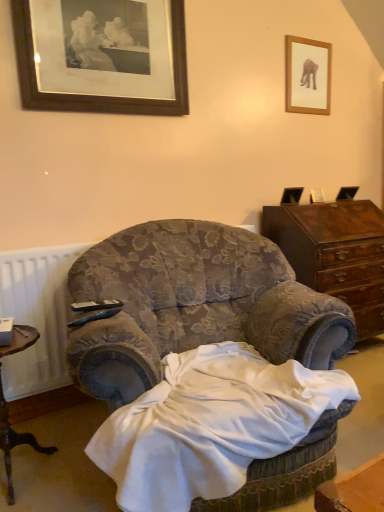
What is the approximate width of dark brown wood cabinet at right?

The width of dark brown wood cabinet at right is 49.28 centimeters.

What is the approximate height of wooden picture frame at upper right, the second picture frame from the left?

wooden picture frame at upper right, the second picture frame from the left, is 18.82 inches tall.

Locate an element on the screen. This screenshot has width=384, height=512. wooden picture frame at upper right, placed as the 1th picture frame when sorted from back to front is located at coordinates (307, 76).

The width and height of the screenshot is (384, 512). What are the coordinates of `black plastic remote control at center, the 1th remote control in the back-to-front sequence` in the screenshot? It's located at (96, 305).

In terms of width, does brown wooden desk at lower left look wider or thinner when compared to dark brown wood cabinet at right?

Considering their sizes, brown wooden desk at lower left looks slimmer than dark brown wood cabinet at right.

Is brown wooden desk at lower left aimed at dark brown wood cabinet at right?

No.

Would you say dark brown wood cabinet at right is part of brown wooden desk at lower left's contents?

No, dark brown wood cabinet at right is not a part of brown wooden desk at lower left.

You are a GUI agent. You are given a task and a screenshot of the screen. Output one action in this format:
    pyautogui.click(x=<x>, y=<y>)
    Task: Click on the cabinetry above the brown wooden desk at lower left (from a real-world perspective)
    The width and height of the screenshot is (384, 512).
    Given the screenshot: What is the action you would take?
    [x=335, y=253]

Can you confirm if wooden picture frame at upper left, arranged as the 1th picture frame when viewed from the front, is shorter than black plastic remote control at center, the 2th remote control positioned from the front?

Incorrect, the height of wooden picture frame at upper left, arranged as the 1th picture frame when viewed from the front, does not fall short of that of black plastic remote control at center, the 2th remote control positioned from the front.

Identify the location of picture frame that is the 1st object located above the black plastic remote control at center, the 2th remote control positioned from the front (from the image's perspective). This screenshot has width=384, height=512. (102, 56).

Is wooden picture frame at upper left, which is the 2th picture frame from right to left, looking in the opposite direction of black plastic remote control at center, the 1th remote control in the back-to-front sequence?

No.

Considering the sizes of objects black plastic remote control at lower left, acting as the 2th remote control starting from the back, and brown wooden desk at lower left in the image provided, who is bigger, black plastic remote control at lower left, acting as the 2th remote control starting from the back, or brown wooden desk at lower left?

Bigger between the two is brown wooden desk at lower left.

Is black plastic remote control at lower left, the 1th remote control positioned from the front, positioned with its back to brown wooden desk at lower left?

black plastic remote control at lower left, the 1th remote control positioned from the front, does not have its back to brown wooden desk at lower left.

Is black plastic remote control at lower left, acting as the 2th remote control starting from the back, shorter than brown wooden desk at lower left?

Correct, black plastic remote control at lower left, acting as the 2th remote control starting from the back, is not as tall as brown wooden desk at lower left.

Considering the positions of point (86, 314) and point (8, 493), is point (86, 314) closer or farther from the camera than point (8, 493)?

Point (86, 314) is closer to the camera than point (8, 493).

Based on the photo, from a real-world perspective, between brown wooden desk at lower left and black plastic remote control at center, the 2th remote control positioned from the front, who is vertically higher?

black plastic remote control at center, the 2th remote control positioned from the front, from a real-world perspective.

Is brown wooden desk at lower left bigger than black plastic remote control at center, the 1th remote control in the back-to-front sequence?

Correct, brown wooden desk at lower left is larger in size than black plastic remote control at center, the 1th remote control in the back-to-front sequence.

Measure the distance between brown wooden desk at lower left and black plastic remote control at center, the 1th remote control in the back-to-front sequence.

brown wooden desk at lower left and black plastic remote control at center, the 1th remote control in the back-to-front sequence, are 22.49 inches apart.

In the image, there is a black plastic remote control at center, the 2th remote control positioned from the front. Where is `desk below it (from a real-world perspective)`? desk below it (from a real-world perspective) is located at coordinates (14, 442).

Considering the sizes of objects dark brown wood cabinet at right and black plastic remote control at lower left, acting as the 2th remote control starting from the back, in the image provided, who is smaller, dark brown wood cabinet at right or black plastic remote control at lower left, acting as the 2th remote control starting from the back,?

With smaller size is black plastic remote control at lower left, acting as the 2th remote control starting from the back.

In the scene shown: From a real-world perspective, does dark brown wood cabinet at right sit lower than black plastic remote control at lower left, the 1th remote control positioned from the front?

Yes, from a real-world perspective, dark brown wood cabinet at right is below black plastic remote control at lower left, the 1th remote control positioned from the front.

Consider the image. Which object is further away from the camera taking this photo, dark brown wood cabinet at right or black plastic remote control at lower left, the 1th remote control positioned from the front?

dark brown wood cabinet at right is behind.

Considering the points (312, 73) and (77, 319), which point is behind, point (312, 73) or point (77, 319)?

The point (312, 73) is behind.

Who is bigger, wooden picture frame at upper right, placed as the 1th picture frame when sorted from back to front, or black plastic remote control at lower left, acting as the 2th remote control starting from the back?

wooden picture frame at upper right, placed as the 1th picture frame when sorted from back to front, is bigger.

Considering the relative sizes of wooden picture frame at upper right, placed as the 1th picture frame when sorted from back to front, and black plastic remote control at lower left, acting as the 2th remote control starting from the back, in the image provided, is wooden picture frame at upper right, placed as the 1th picture frame when sorted from back to front, wider than black plastic remote control at lower left, acting as the 2th remote control starting from the back,?

Incorrect, the width of wooden picture frame at upper right, placed as the 1th picture frame when sorted from back to front, does not surpass that of black plastic remote control at lower left, acting as the 2th remote control starting from the back.

From the picture: From a real-world perspective, which object stands above the other?

In real-world perspective, wooden picture frame at upper left, the first picture frame from the left, is above.

Which of these two, wooden picture frame at upper right, the second picture frame from the left, or wooden picture frame at upper left, arranged as the 1th picture frame when viewed from the front, stands taller?

wooden picture frame at upper left, arranged as the 1th picture frame when viewed from the front, is taller.

Which object is further away from the camera taking this photo, wooden picture frame at upper right, placed as the 1th picture frame when sorted from back to front, or wooden picture frame at upper left, which is the 2th picture frame from right to left?

wooden picture frame at upper right, placed as the 1th picture frame when sorted from back to front, is further from the camera.

Considering the relative sizes of wooden picture frame at upper right, which is counted as the 1th picture frame, starting from the right, and wooden picture frame at upper left, the first picture frame from the left, in the image provided, is wooden picture frame at upper right, which is counted as the 1th picture frame, starting from the right, bigger than wooden picture frame at upper left, the first picture frame from the left,?

No, wooden picture frame at upper right, which is counted as the 1th picture frame, starting from the right, is not bigger than wooden picture frame at upper left, the first picture frame from the left.

Identify the location of cabinetry above the brown wooden desk at lower left (from a real-world perspective). (335, 253).

The image size is (384, 512). What are the coordinates of `the 1st picture frame behind the black plastic remote control at center, the 1th remote control in the back-to-front sequence, counting from the anchor's position` in the screenshot? It's located at (102, 56).

Considering their positions, is wooden picture frame at upper left, which is the 2th picture frame from right to left, positioned further to dark brown wood cabinet at right than wooden picture frame at upper right, which is counted as the 1th picture frame, starting from the right?

Among the two, wooden picture frame at upper left, which is the 2th picture frame from right to left, is located further to dark brown wood cabinet at right.

Looking at this image, when comparing their distances from wooden picture frame at upper left, the 2th picture frame in the back-to-front sequence, does brown wooden desk at lower left or dark brown wood cabinet at right seem further?

Among the two, brown wooden desk at lower left is located further to wooden picture frame at upper left, the 2th picture frame in the back-to-front sequence.

Looking at this image, from the image, which object appears to be nearer to black plastic remote control at lower left, the 1th remote control positioned from the front, wooden picture frame at upper left, the 2th picture frame in the back-to-front sequence, or black plastic remote control at center, the 1th remote control in the back-to-front sequence?

Based on the image, black plastic remote control at center, the 1th remote control in the back-to-front sequence, appears to be nearer to black plastic remote control at lower left, the 1th remote control positioned from the front.

Considering their positions, is black plastic remote control at lower left, the 1th remote control positioned from the front, positioned closer to brown wooden desk at lower left than velvet floral armchair at center?

black plastic remote control at lower left, the 1th remote control positioned from the front, is closer to brown wooden desk at lower left.

When comparing their distances from velvet floral armchair at center, does wooden picture frame at upper right, placed as the second picture frame when sorted from front to back, or brown wooden desk at lower left seem further?

wooden picture frame at upper right, placed as the second picture frame when sorted from front to back, is further to velvet floral armchair at center.

Which object lies further to the anchor point black plastic remote control at lower left, acting as the 2th remote control starting from the back, brown wooden desk at lower left or black plastic remote control at center, the 2th remote control positioned from the front?

Based on the image, brown wooden desk at lower left appears to be further to black plastic remote control at lower left, acting as the 2th remote control starting from the back.

From the image, which object appears to be nearer to wooden picture frame at upper left, the 2th picture frame in the back-to-front sequence, black plastic remote control at lower left, acting as the 2th remote control starting from the back, or black plastic remote control at center, the 1th remote control in the back-to-front sequence?

Based on the image, black plastic remote control at center, the 1th remote control in the back-to-front sequence, appears to be nearer to wooden picture frame at upper left, the 2th picture frame in the back-to-front sequence.

Considering their positions, is black plastic remote control at lower left, the 1th remote control positioned from the front, positioned further to wooden picture frame at upper left, arranged as the 1th picture frame when viewed from the front, than brown wooden desk at lower left?

Based on the image, brown wooden desk at lower left appears to be further to wooden picture frame at upper left, arranged as the 1th picture frame when viewed from the front.

At what (x,y) coordinates should I click in order to perform the action: click on remote control that lies between black plastic remote control at center, the 2th remote control positioned from the front, and brown wooden desk at lower left from top to bottom. Please return your answer as a coordinate pair (x, y). The height and width of the screenshot is (512, 384). Looking at the image, I should click on (94, 316).

Identify the location of picture frame located between wooden picture frame at upper left, the 2th picture frame in the back-to-front sequence, and dark brown wood cabinet at right in the left-right direction. (307, 76).

Locate an element on the screen. This screenshot has width=384, height=512. picture frame between wooden picture frame at upper right, placed as the second picture frame when sorted from front to back, and black plastic remote control at lower left, acting as the 2th remote control starting from the back, in the up-down direction is located at coordinates 102,56.

Locate an element on the screen. Image resolution: width=384 pixels, height=512 pixels. chair between brown wooden desk at lower left and dark brown wood cabinet at right is located at coordinates (194, 305).